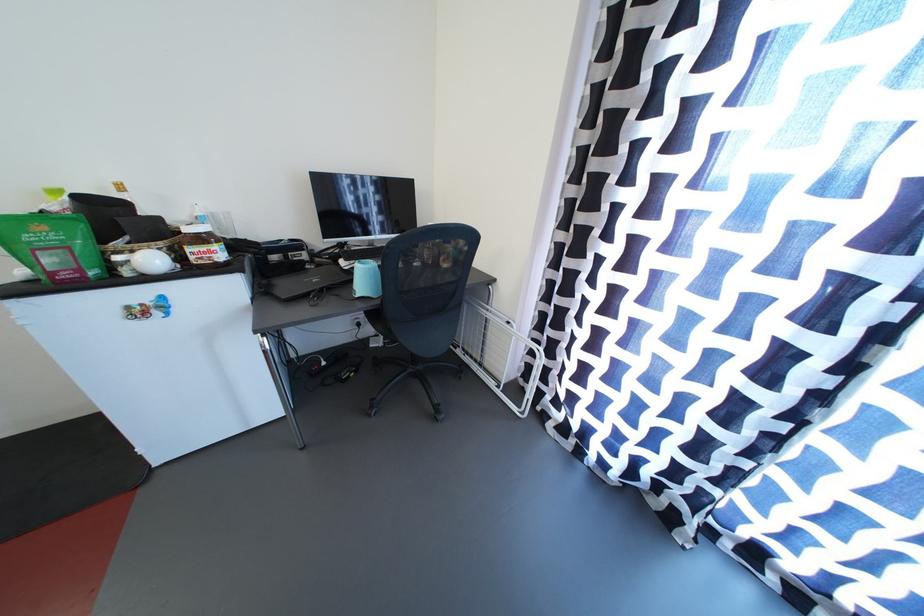
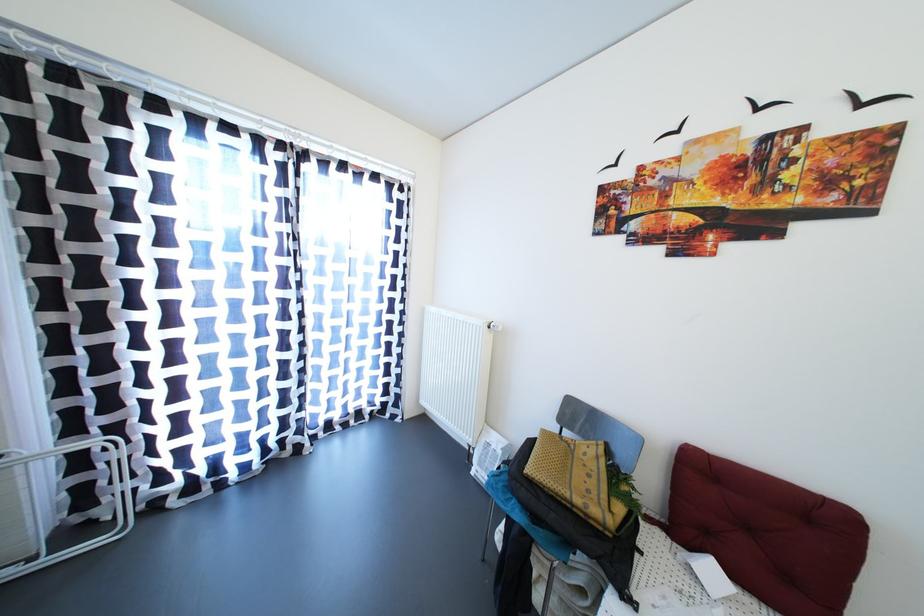
Find the pixel in the second image that matches (505,391) in the first image.

(39, 564)